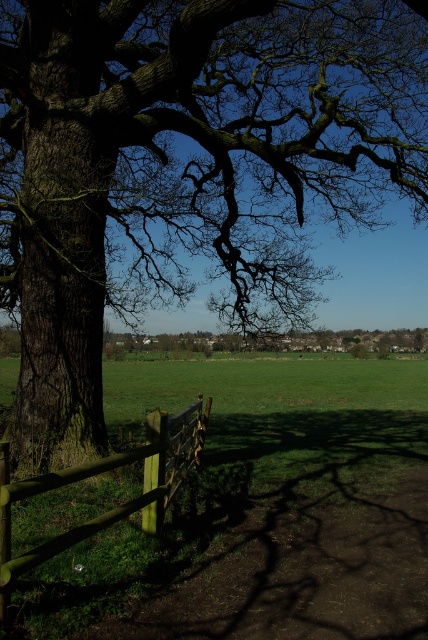
You are standing at the point labeled point (x=184, y=168) in the image. What object is directly in front of you?

The dark brown textured oak tree at left is directly in front of you at point (x=184, y=168).

You are standing at the center of the image and want to walk towards the dark brown textured oak tree at left. In which general direction should you head?

You should head to the left because the dark brown textured oak tree at left is located at point 0.264 on the x axis, which is to the left of the center point at 0.5.

You are standing in the rural area and want to take a photo of the dark brown textured oak tree at left. However, there is a wooden fence at lower left blocking your view. Can you move to the right to get a clear shot without the fence obstructing the tree?

The dark brown textured oak tree at left is in front of the wooden fence at lower left, so moving to the right might still show the tree behind the fence. To get a clear shot without obstruction, you need to position yourself where the fence does not block the view of the tree.